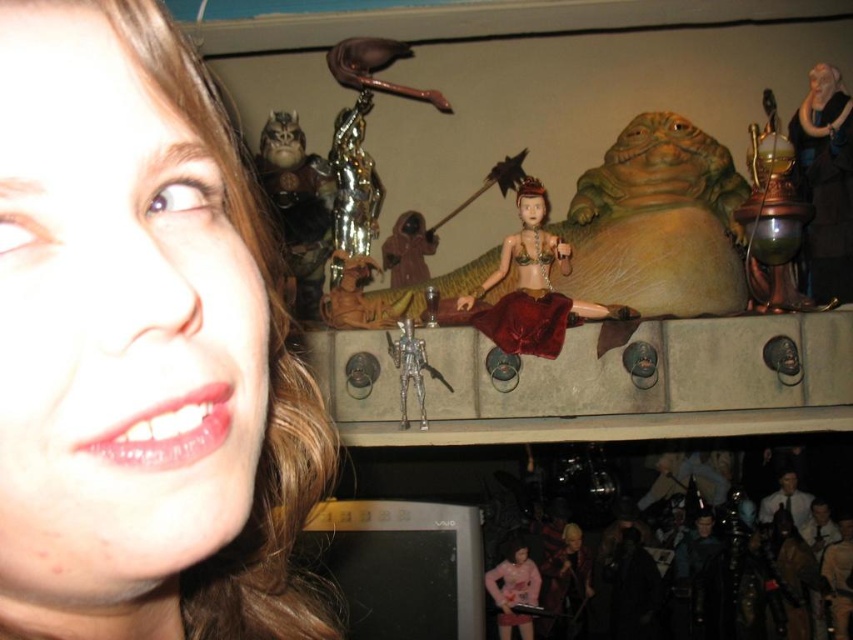
Is smooth beige statue at upper right smaller than pink fabric doll at lower center?

No.

Is smooth beige statue at upper right to the left of pink fabric doll at lower center from the viewer's perspective?

Incorrect, smooth beige statue at upper right is not on the left side of pink fabric doll at lower center.

Who is more forward, (813, 211) or (502, 616)?

Point (813, 211) is more forward.

Locate an element on the screen. This screenshot has height=640, width=853. smooth beige statue at upper right is located at coordinates (825, 180).

What do you see at coordinates (141, 348) in the screenshot? I see `matte skin at left` at bounding box center [141, 348].

Is matte skin at left closer to camera compared to smooth beige statue at upper right?

Yes, matte skin at left is closer to the viewer.

Is point (233, 243) closer to viewer compared to point (834, 180)?

That is True.

Find the location of a particular element. This screenshot has width=853, height=640. matte skin at left is located at coordinates (141, 348).

Who is shorter, matte skin at left or pink fabric doll at lower center?

pink fabric doll at lower center

At what (x,y) coordinates should I click in order to perform the action: click on matte skin at left. Please return your answer as a coordinate pair (x, y). Looking at the image, I should click on (141, 348).

Identify the location of matte skin at left. This screenshot has width=853, height=640. (141, 348).

Identify the location of matte skin at left. The height and width of the screenshot is (640, 853). (141, 348).